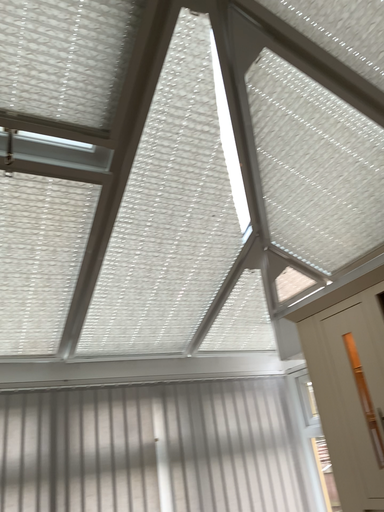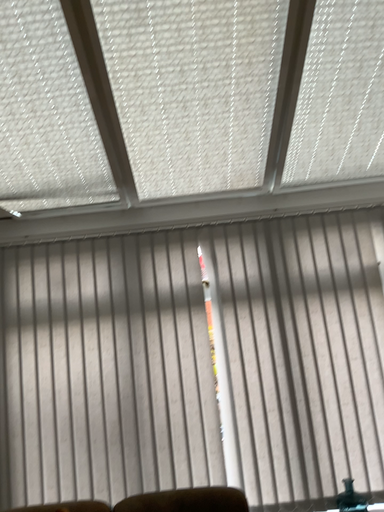
Question: Which way did the camera rotate in the video?

Choices:
 (A) rotated right
 (B) rotated left

Answer: (B)